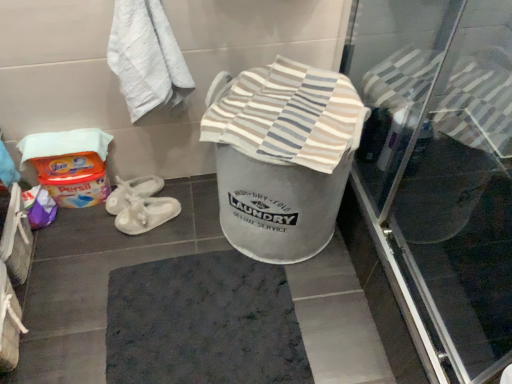
Question: Based on their sizes in the image, would you say dark gray textured bath mat at center is bigger or smaller than white textured towel at upper left?

Choices:
 (A) big
 (B) small

Answer: (B)

Question: Looking at their shapes, would you say dark gray textured bath mat at center is wider or thinner than white textured towel at upper left?

Choices:
 (A) wide
 (B) thin

Answer: (A)

Question: Which object is the closest to the transparent glass screen door at upper right?

Choices:
 (A) dark gray textured bath mat at center
 (B) white textured towel at upper left
 (C) striped cotton towel at center

Answer: (C)

Question: Estimate the real-world distances between objects in this image. Which object is farther from the dark gray textured bath mat at center?

Choices:
 (A) transparent glass screen door at upper right
 (B) white textured towel at upper left
 (C) striped cotton towel at center

Answer: (B)